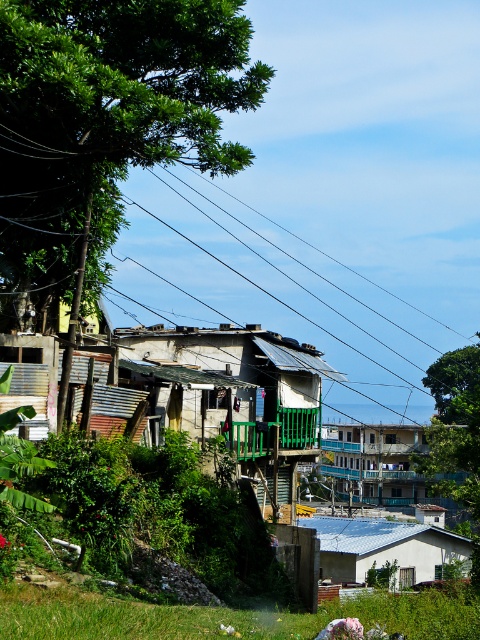
You are a delivery drone flying over the residential area. You need to drop a package onto the blue painted wood balcony at center. However, there is a black wire at upper center above it. Can you safely land on the balcony without hitting the wire?

The black wire at upper center is positioned over the blue painted wood balcony at center, so the drone must ensure sufficient clearance to avoid the wire when landing on the balcony. If the drone can descend below the wire while maintaining stability, it should be possible to land safely.

You are a delivery person trying to deliver a package to the rusty corrugated metal hut at center. You see the green leafy tree at upper left blocking your path. Can you walk around the tree to reach the hut?

The green leafy tree at upper left is in front of the rusty corrugated metal hut at center, so you can walk around the tree to reach the hut.